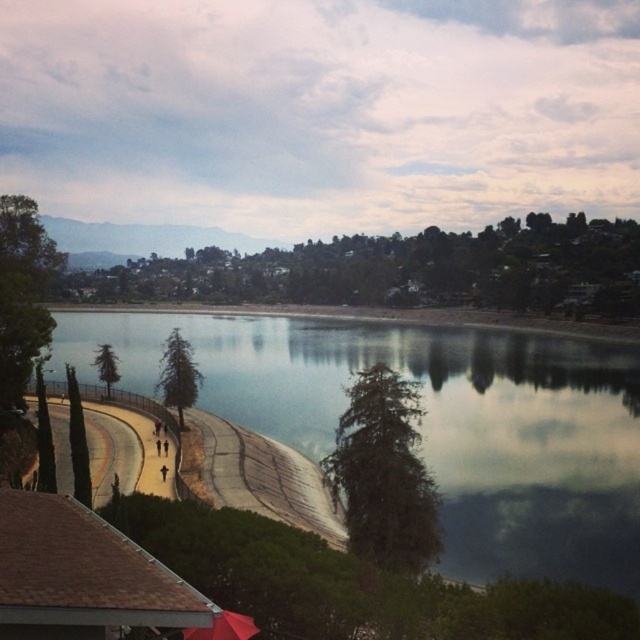
Who is shorter, clear water at center or red matte umbrella at lower center?

Standing shorter between the two is red matte umbrella at lower center.

You are a GUI agent. You are given a task and a screenshot of the screen. Output one action in this format:
    pyautogui.click(x=<x>, y=<y>)
    Task: Click on the clear water at center
    This screenshot has width=640, height=640.
    Given the screenshot: What is the action you would take?
    pyautogui.click(x=435, y=422)